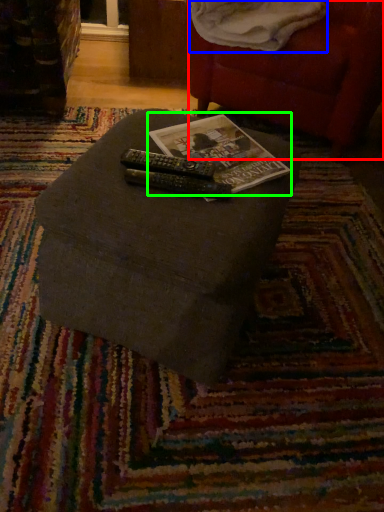
Question: Which object is the farthest from bean bag chair (highlighted by a red box)? Choose among these: blanket (highlighted by a blue box) or paperback book (highlighted by a green box).

Choices:
 (A) blanket
 (B) paperback book

Answer: (B)